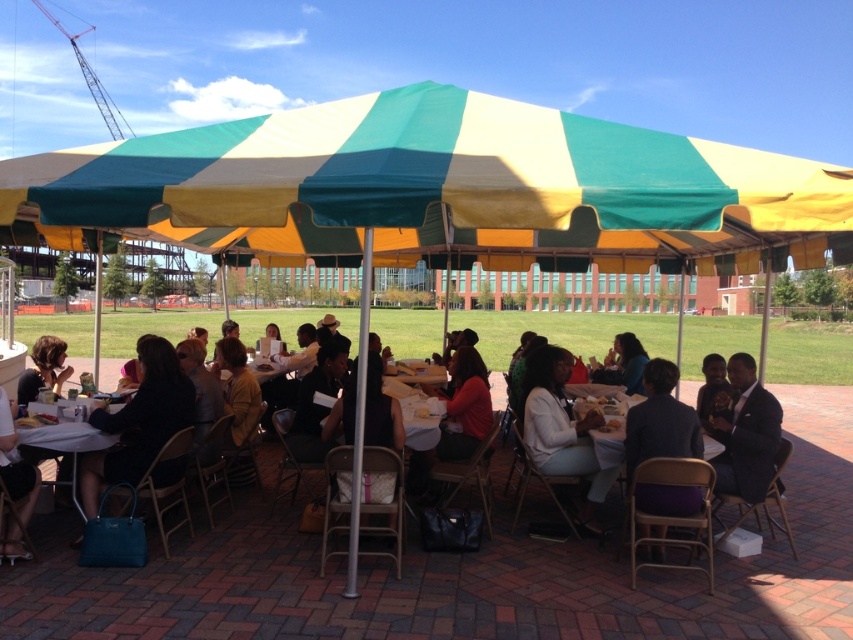
Question: Which point appears closest to the camera in this image?

Choices:
 (A) (306, 444)
 (B) (746, 481)

Answer: (B)

Question: Estimate the real-world distances between objects in this image. Which object is closer to the white plastic table at lower left?

Choices:
 (A) matte black hair at lower left
 (B) matte black jacket at center

Answer: (A)

Question: Is matte black handbag at lower left to the left of dark gray suit at lower right from the viewer's perspective?

Choices:
 (A) yes
 (B) no

Answer: (A)

Question: Which point is farther to the camera?

Choices:
 (A) white plastic table at lower left
 (B) green/yellow striped canopy at center
 (C) matte black bag at lower left
 (D) black matte shirt at center

Answer: (D)

Question: Observing the image, what is the correct spatial positioning of white matte jacket at center in reference to matte black jacket at center?

Choices:
 (A) right
 (B) left

Answer: (B)

Question: Can you confirm if matte black hair at lower left is thinner than smooth black suit at lower right?

Choices:
 (A) no
 (B) yes

Answer: (A)